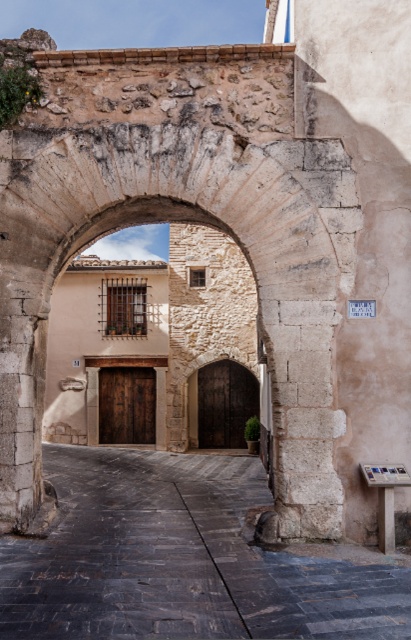
Does stone archway at center have a greater height compared to dark stone alley at center?

Indeed, stone archway at center has a greater height compared to dark stone alley at center.

Is point (334, 260) behind point (115, 557)?

Yes, point (334, 260) is farther from viewer.

Is point (325, 358) positioned before point (0, 557)?

No.

In order to click on stone archway at center in this screenshot , I will do `click(196, 221)`.